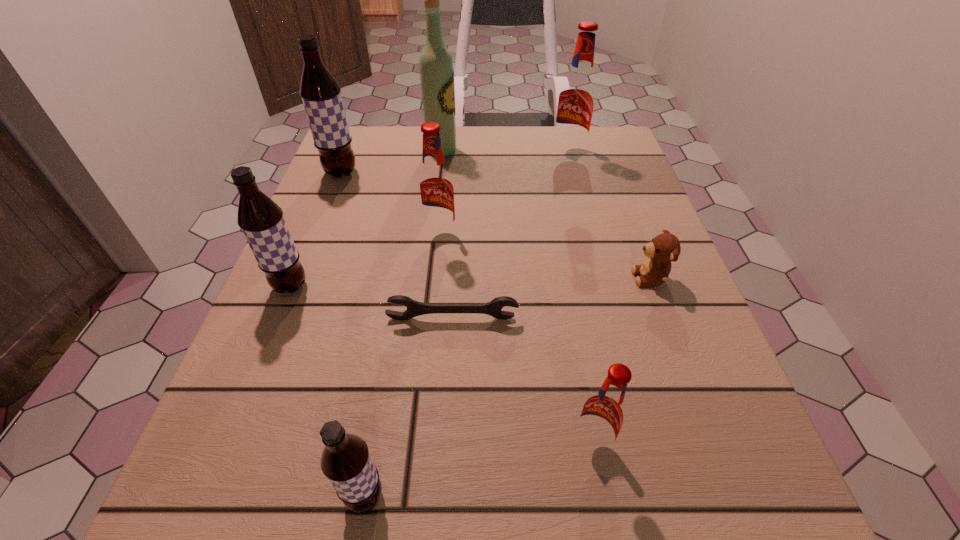
Identify the location of object that is the eighth closest to the second farthest brown root beer. The width and height of the screenshot is (960, 540). (577, 96).

This screenshot has width=960, height=540. I want to click on root beer that is the closest to the second nearest root beer, so click(x=346, y=462).

Select which root beer is the second closest to the wine bottle. Please provide its 2D coordinates. Your answer should be formatted as a tuple, i.e. [(x, y)], where the tuple contains the x and y coordinates of a point satisfying the conditions above.

[(577, 96)]

The height and width of the screenshot is (540, 960). Identify the location of the second closest red root beer to the second smallest red root beer. (603, 415).

Choose which red root beer is the third nearest neighbor to the third nearest object. Please provide its 2D coordinates. Your answer should be formatted as a tuple, i.e. [(x, y)], where the tuple contains the x and y coordinates of a point satisfying the conditions above.

[(577, 96)]

Locate an element on the screen. The width and height of the screenshot is (960, 540). brown root beer identified as the closest to the biggest brown root beer is located at coordinates (260, 218).

Identify which brown root beer is the second nearest to the second smallest brown root beer. Please provide its 2D coordinates. Your answer should be formatted as a tuple, i.e. [(x, y)], where the tuple contains the x and y coordinates of a point satisfying the conditions above.

[(346, 462)]

Locate an element on the screen. The height and width of the screenshot is (540, 960). free location that satisfies the following two spatial constraints: 1. on the front side of the fourth nearest root beer; 2. on the left side of the second red root beer from left to right is located at coordinates 420,445.

Where is `vacant space that satisfies the following two spatial constraints: 1. on the back side of the fourth root beer from left to right; 2. on the left side of the farthest red root beer`? The image size is (960, 540). vacant space that satisfies the following two spatial constraints: 1. on the back side of the fourth root beer from left to right; 2. on the left side of the farthest red root beer is located at coordinates (447, 154).